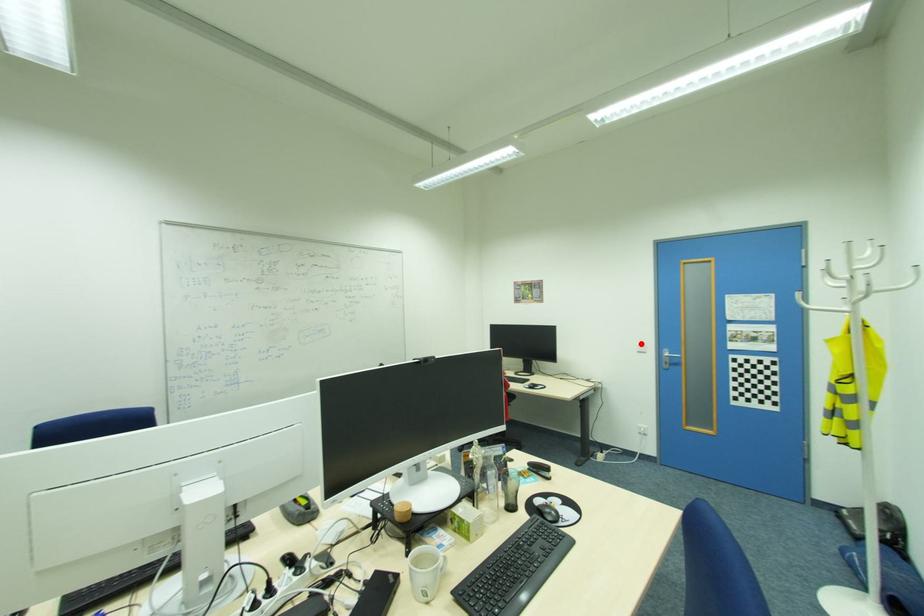
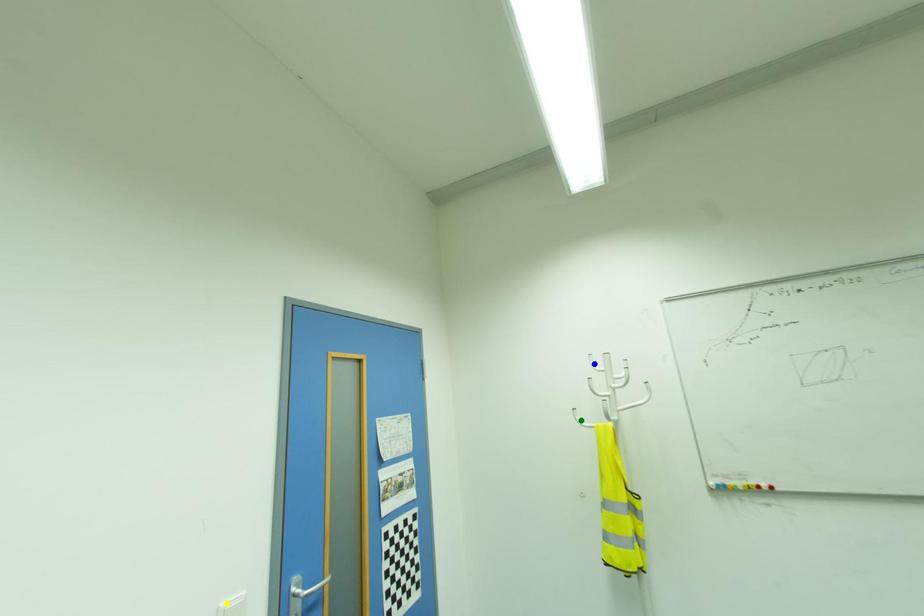
Question: I am providing you with two images of the same scene from different viewpoints. A red point is marked on the first image. You are given multiple points on the second image. In image 2, which mark is for the same physical point as the one in image 1?

Choices:
 (A) yellow point
 (B) green point
 (C) blue point

Answer: (A)